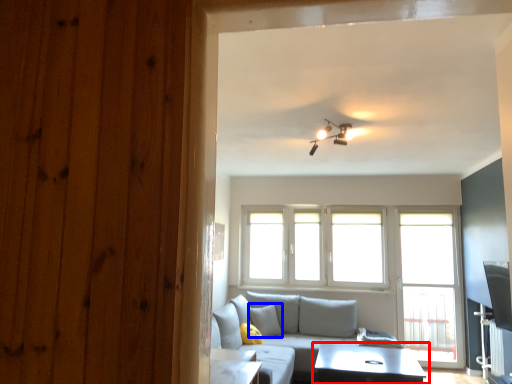
Question: Which point is further to the camera, table (highlighted by a red box) or pillow (highlighted by a blue box)?

Choices:
 (A) table
 (B) pillow

Answer: (B)